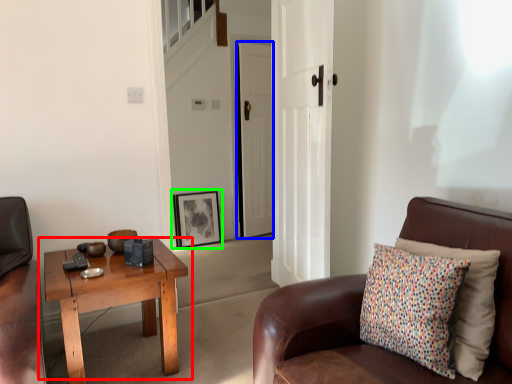
Question: Estimate the real-world distances between objects in this image. Which object is farther from coffee table (highlighted by a red box), door (highlighted by a blue box) or picture frame (highlighted by a green box)?

Choices:
 (A) door
 (B) picture frame

Answer: (A)